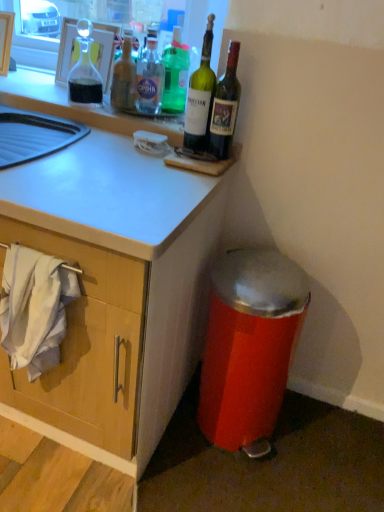
At what (x,y) coordinates should I click in order to perform the action: click on free space to the left of clear glass carafe at upper left. Please return your answer as a coordinate pair (x, y). Looking at the image, I should click on (39, 90).